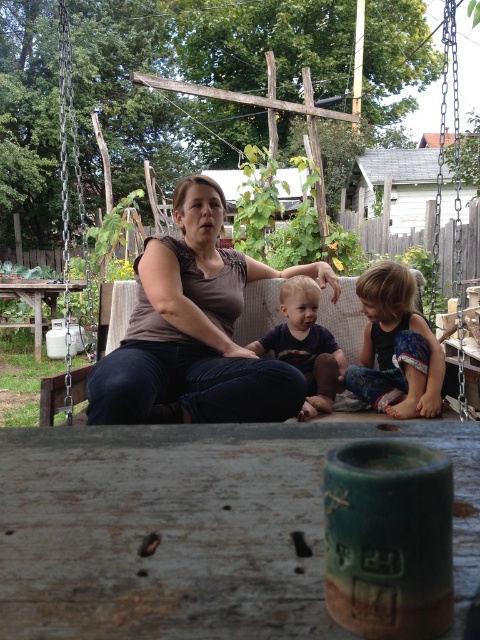
Question: Is floral fabric dress at lower right smaller than blonde hair toddler at center?

Choices:
 (A) no
 (B) yes

Answer: (B)

Question: Which point appears closest to the camera in this image?

Choices:
 (A) (289, 296)
 (B) (7, 292)

Answer: (A)

Question: Does matte brown tank top at center have a smaller size compared to blonde hair toddler at center?

Choices:
 (A) no
 (B) yes

Answer: (A)

Question: Among these objects, which one is farthest from the camera?

Choices:
 (A) blonde hair toddler at center
 (B) wooden swing at center
 (C) matte brown tank top at center

Answer: (A)

Question: Does wooden swing at center appear on the left side of green leafy plant at left?

Choices:
 (A) no
 (B) yes

Answer: (A)

Question: Among these points, which one is farthest from the camera?

Choices:
 (A) (204, 93)
 (B) (34, 312)
 (C) (416, 410)

Answer: (B)